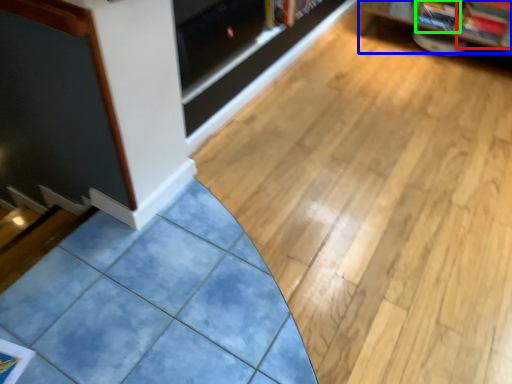
Question: Which object is positioned farthest from magazine (highlighted by a red box)? Select from shelf (highlighted by a blue box) and magazine (highlighted by a green box).

Choices:
 (A) shelf
 (B) magazine

Answer: (A)